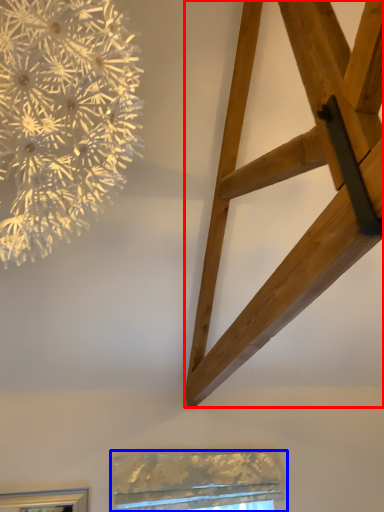
Question: Which object is further to the camera taking this photo, furniture (highlighted by a red box) or window (highlighted by a blue box)?

Choices:
 (A) furniture
 (B) window

Answer: (B)